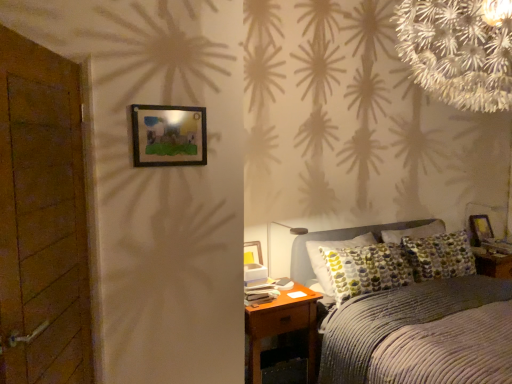
Describe the element at coordinates (42, 217) in the screenshot. I see `wooden door at left` at that location.

I want to click on matte gray table lamp at center, so click(x=272, y=239).

Locate an element on the screen. This screenshot has height=384, width=512. brown wooden nightstand at lower right is located at coordinates (282, 327).

Where is `wooden picture frame at upper center, acting as the second picture frame starting from the back`? The height and width of the screenshot is (384, 512). wooden picture frame at upper center, acting as the second picture frame starting from the back is located at coordinates (168, 135).

You are a GUI agent. You are given a task and a screenshot of the screen. Output one action in this format:
    pyautogui.click(x=<x>, y=<y>)
    Task: Click on the wooden door at left
    
    Given the screenshot: What is the action you would take?
    pyautogui.click(x=42, y=217)

Would you say brown wooden nightstand at lower right is part of matte gray table lamp at center's contents?

No, brown wooden nightstand at lower right is located outside of matte gray table lamp at center.

Which point is more distant from viewer, (x=269, y=266) or (x=294, y=283)?

The point (x=294, y=283) is more distant.

Where is `nightstand in front of the matte gray table lamp at center`? This screenshot has height=384, width=512. nightstand in front of the matte gray table lamp at center is located at coordinates (282, 327).

Is corduroy bed at center to the left of wooden picture frame at right, the first picture frame when ordered from bottom to top, from the viewer's perspective?

Correct, you'll find corduroy bed at center to the left of wooden picture frame at right, the first picture frame when ordered from bottom to top.

Between corduroy bed at center and wooden picture frame at right, the second picture frame from the front, which one has larger width?

With larger width is corduroy bed at center.

Is corduroy bed at center located outside wooden picture frame at right, the first picture frame when ordered from bottom to top?

Indeed, corduroy bed at center is completely outside wooden picture frame at right, the first picture frame when ordered from bottom to top.

From the image's perspective, which is above, corduroy bed at center or wooden picture frame at right, which ranks as the 1th picture frame in right-to-left order?

wooden picture frame at right, which ranks as the 1th picture frame in right-to-left order.

Is point (169, 106) positioned behind point (481, 241)?

That is False.

This screenshot has width=512, height=384. Find the location of `picture frame below the wooden picture frame at upper center, the 1th picture frame positioned from the top (from a real-world perspective)`. picture frame below the wooden picture frame at upper center, the 1th picture frame positioned from the top (from a real-world perspective) is located at coordinates (480, 229).

Is wooden picture frame at upper center, the second picture frame when ordered from bottom to top, aimed at wooden picture frame at right, which is the first picture frame in back-to-front order?

No, wooden picture frame at upper center, the second picture frame when ordered from bottom to top, is not facing towards wooden picture frame at right, which is the first picture frame in back-to-front order.

Considering the positions of objects wooden picture frame at upper center, the second picture frame when ordered from bottom to top, and wooden picture frame at right, which is the first picture frame in back-to-front order, in the image provided, who is more to the right, wooden picture frame at upper center, the second picture frame when ordered from bottom to top, or wooden picture frame at right, which is the first picture frame in back-to-front order,?

Positioned to the right is wooden picture frame at right, which is the first picture frame in back-to-front order.

Is wooden picture frame at right, which is the first picture frame in back-to-front order, directly adjacent to matte gray table lamp at center?

wooden picture frame at right, which is the first picture frame in back-to-front order, is not next to matte gray table lamp at center, and they're not touching.

Which is more to the right, wooden picture frame at right, which is the 2th picture frame in top-to-bottom order, or matte gray table lamp at center?

wooden picture frame at right, which is the 2th picture frame in top-to-bottom order, is more to the right.

From a real-world perspective, which object rests below the other?

In real-world perspective, wooden picture frame at right, which is the first picture frame in back-to-front order, is lower.

Considering the sizes of objects wooden door at left and matte gray table lamp at center in the image provided, who is wider, wooden door at left or matte gray table lamp at center?

matte gray table lamp at center.

Does wooden door at left turn towards matte gray table lamp at center?

No.

Between point (19, 113) and point (269, 258), which one is positioned in front?

Point (19, 113)

Would you say matte gray table lamp at center is part of wooden door at left's contents?

No.

Is wooden picture frame at right, which ranks as the 1th picture frame in right-to-left order, surrounding wooden door at left?

No, wooden door at left is not inside wooden picture frame at right, which ranks as the 1th picture frame in right-to-left order.

From the image's perspective, is wooden picture frame at right, the second picture frame from the front, above wooden door at left?

Incorrect, from the image's perspective, wooden picture frame at right, the second picture frame from the front, is lower than wooden door at left.

Does point (488, 224) come in front of point (8, 141)?

No, it is not.

Could you tell me if wooden picture frame at right, the first picture frame when ordered from bottom to top, is facing wooden door at left?

No, wooden picture frame at right, the first picture frame when ordered from bottom to top, does not turn towards wooden door at left.

From a real-world perspective, which is physically below, matte gray table lamp at center or corduroy bed at center?

From a 3D spatial view, corduroy bed at center is below.

Which of these two, matte gray table lamp at center or corduroy bed at center, stands taller?

Standing taller between the two is corduroy bed at center.

From the image's perspective, would you say matte gray table lamp at center is positioned over corduroy bed at center?

Yes, from the image's perspective, matte gray table lamp at center is above corduroy bed at center.

Which object is more forward, matte gray table lamp at center or corduroy bed at center?

corduroy bed at center.

Find the location of a particular element. The image size is (512, 384). nightstand below the matte gray table lamp at center (from the image's perspective) is located at coordinates (282, 327).

Identify the location of bed in front of the wooden picture frame at right, the 2th picture frame positioned from the left. (422, 335).

Considering their positions, is wooden door at left positioned closer to wooden picture frame at upper center, acting as the second picture frame starting from the back, than wooden picture frame at right, which ranks as the 1th picture frame in right-to-left order?

Based on the image, wooden door at left appears to be nearer to wooden picture frame at upper center, acting as the second picture frame starting from the back.

Which object lies further to the anchor point corduroy bed at center, matte gray table lamp at center or brown wooden nightstand at lower right?

matte gray table lamp at center is further to corduroy bed at center.

Considering their positions, is wooden door at left positioned further to wooden picture frame at upper center, positioned as the first picture frame in front-to-back order, than brown wooden nightstand at lower right?

brown wooden nightstand at lower right is further to wooden picture frame at upper center, positioned as the first picture frame in front-to-back order.

Based on their spatial positions, is wooden door at left or wooden picture frame at upper center, the second picture frame when ordered from bottom to top, closer to brown wooden nightstand at lower right?

Based on the image, wooden picture frame at upper center, the second picture frame when ordered from bottom to top, appears to be nearer to brown wooden nightstand at lower right.

Considering their positions, is corduroy bed at center positioned further to brown wooden nightstand at lower right than wooden door at left?

Based on the image, wooden door at left appears to be further to brown wooden nightstand at lower right.

Based on their spatial positions, is wooden picture frame at right, which is the first picture frame in back-to-front order, or wooden picture frame at upper center, positioned as the first picture frame in front-to-back order, closer to matte gray table lamp at center?

wooden picture frame at upper center, positioned as the first picture frame in front-to-back order, is closer to matte gray table lamp at center.

Estimate the real-world distances between objects in this image. Which object is further from matte gray table lamp at center, wooden picture frame at upper center, the second picture frame when ordered from bottom to top, or brown wooden nightstand at lower right?

Among the two, wooden picture frame at upper center, the second picture frame when ordered from bottom to top, is located further to matte gray table lamp at center.

Looking at this image, based on their spatial positions, is wooden picture frame at right, the first picture frame when ordered from bottom to top, or corduroy bed at center closer to wooden door at left?

corduroy bed at center.

Where is `picture frame positioned between wooden door at left and brown wooden nightstand at lower right from near to far`? picture frame positioned between wooden door at left and brown wooden nightstand at lower right from near to far is located at coordinates (168, 135).

The image size is (512, 384). I want to click on picture frame between wooden door at left and corduroy bed at center from left to right, so click(x=168, y=135).

Image resolution: width=512 pixels, height=384 pixels. In order to click on picture frame positioned between wooden door at left and matte gray table lamp at center from near to far in this screenshot , I will do point(168,135).

In order to click on table lamp between wooden picture frame at upper center, the second picture frame positioned from the right, and wooden picture frame at right, the first picture frame when ordered from bottom to top, from left to right in this screenshot , I will do `click(272, 239)`.